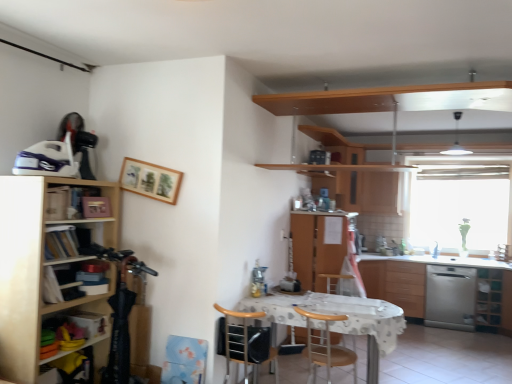
This screenshot has width=512, height=384. In order to click on vacant area on top of wooden picture frame at upper center (from a real-world perspective) in this screenshot , I will do `click(147, 160)`.